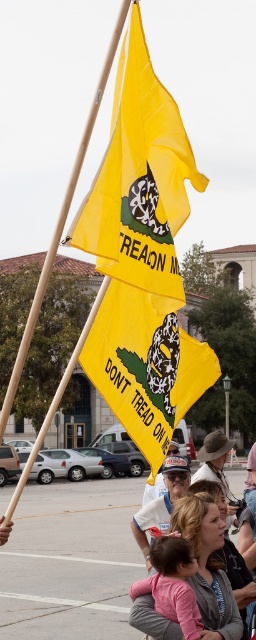
Question: Among these points, which one is farthest from the camera?

Choices:
 (A) tap(98, 88)
 (B) tap(168, 124)
 (C) tap(158, 404)
 (D) tap(222, 605)

Answer: (D)

Question: Which is farther from the yellow matte flag at center?

Choices:
 (A) pink fabric baby at lower center
 (B) wooden pole at upper center
 (C) yellow fabric flag at upper center
 (D) white paper hat at center

Answer: (B)

Question: Can you confirm if yellow matte flag at center is positioned to the right of wooden pole at upper center?

Choices:
 (A) yes
 (B) no

Answer: (A)

Question: Is the position of pink fabric baby at lower center more distant than that of wooden pole at upper center?

Choices:
 (A) yes
 (B) no

Answer: (A)

Question: Observing the image, what is the correct spatial positioning of yellow fabric flag at upper center in reference to yellow matte flag at center?

Choices:
 (A) right
 (B) left

Answer: (A)

Question: Considering the real-world distances, which object is farthest from the wooden pole at upper center?

Choices:
 (A) yellow fabric flag at upper center
 (B) white paper hat at center
 (C) yellow matte flag at center

Answer: (A)